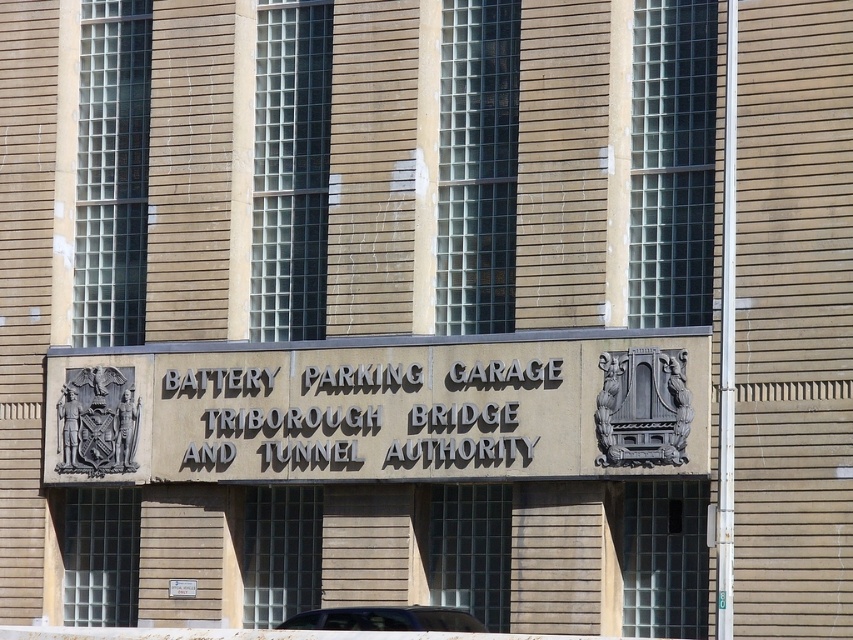
Question: Can you confirm if gray stone sign at center is positioned to the right of metallic sign at center?

Choices:
 (A) yes
 (B) no

Answer: (A)

Question: Estimate the real-world distances between objects in this image. Which object is farther from the satin silver car at center?

Choices:
 (A) black stone sign at center
 (B) gray stone sign at center

Answer: (A)

Question: Can you confirm if black stone sign at center is smaller than satin silver car at center?

Choices:
 (A) no
 (B) yes

Answer: (B)

Question: Is black stone sign at center bigger than metallic sign at center?

Choices:
 (A) yes
 (B) no

Answer: (A)

Question: Which point is closer to the camera taking this photo?

Choices:
 (A) (194, 593)
 (B) (314, 609)

Answer: (A)

Question: Which object is farther from the camera taking this photo?

Choices:
 (A) black stone sign at center
 (B) gray stone sign at center

Answer: (A)